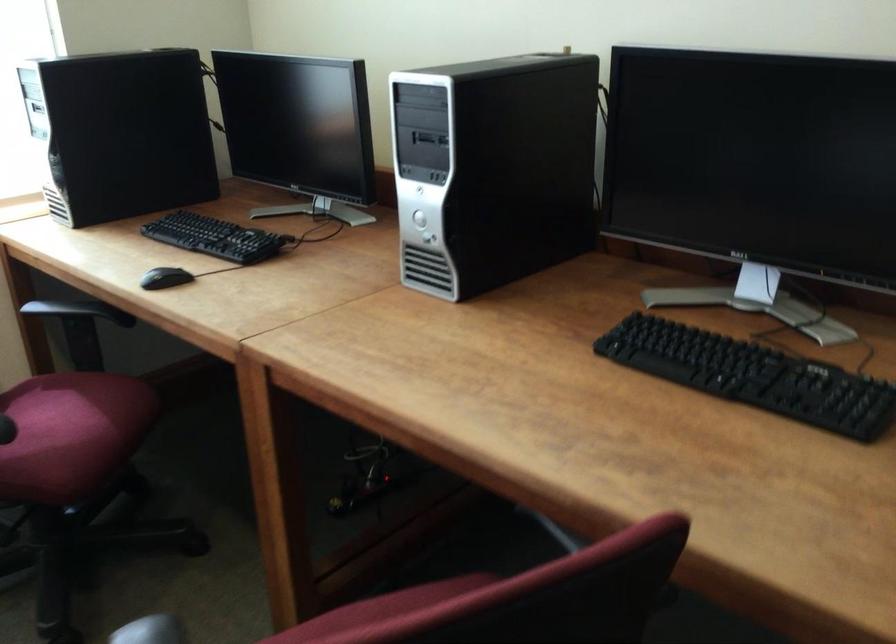
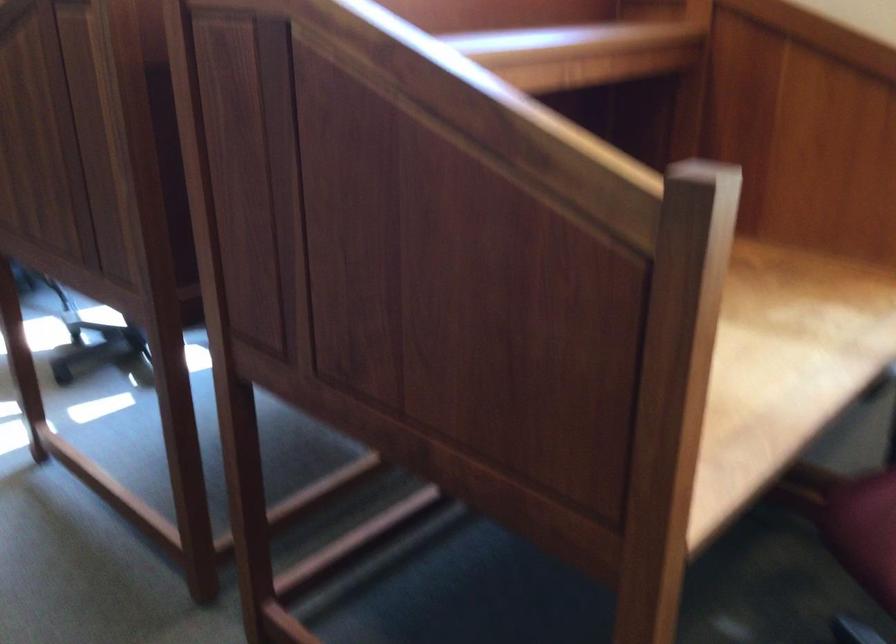
How did the camera likely rotate?

The camera's rotation is toward left-down.